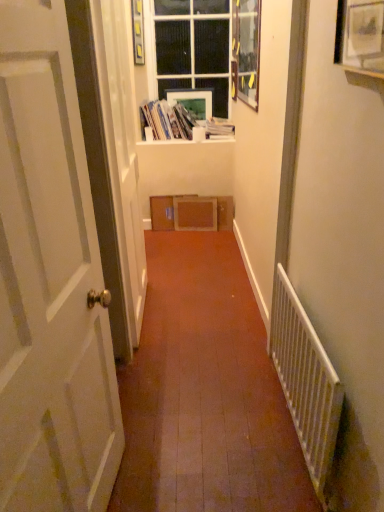
Question: Which direction should I rotate to look at matte white picture frame at upper center, the fourth picture frame when ordered from front to back?

Choices:
 (A) left
 (B) right

Answer: (A)

Question: From the image's perspective, would you say white paper book at upper center, placed as the second book when sorted from left to right, is positioned over wooden picture frame at upper center, which ranks as the 3th picture frame in back-to-front order?

Choices:
 (A) yes
 (B) no

Answer: (B)

Question: From the image's perspective, is white paper book at upper center, which ranks as the first book in right-to-left order, beneath wooden picture frame at upper center, which ranks as the 3th picture frame in back-to-front order?

Choices:
 (A) yes
 (B) no

Answer: (A)

Question: Is white paper book at upper center, which ranks as the first book in right-to-left order, in contact with wooden picture frame at upper center, which ranks as the 3th picture frame in back-to-front order?

Choices:
 (A) no
 (B) yes

Answer: (A)

Question: Would you say white paper book at upper center, which ranks as the first book in right-to-left order, is outside wooden picture frame at upper center, which ranks as the 3th picture frame in back-to-front order?

Choices:
 (A) no
 (B) yes

Answer: (B)

Question: Does white paper book at upper center, which ranks as the first book in right-to-left order, lie in front of wooden picture frame at upper center, which ranks as the 3th picture frame in back-to-front order?

Choices:
 (A) no
 (B) yes

Answer: (A)

Question: Does white paper book at upper center, which ranks as the first book in right-to-left order, appear on the right side of wooden picture frame at upper center, acting as the 2th picture frame starting from the right?

Choices:
 (A) yes
 (B) no

Answer: (B)

Question: Can you confirm if white wooden door at left is smaller than wooden picture frame at upper center, acting as the 2th picture frame starting from the right?

Choices:
 (A) no
 (B) yes

Answer: (A)

Question: Is white wooden door at left placed right next to wooden picture frame at upper center, which is counted as the third picture frame, starting from the left?

Choices:
 (A) no
 (B) yes

Answer: (A)

Question: Does white wooden door at left have a larger size compared to wooden picture frame at upper center, which ranks as the 3th picture frame in back-to-front order?

Choices:
 (A) yes
 (B) no

Answer: (A)

Question: Can you confirm if white wooden door at left is taller than wooden picture frame at upper center, which ranks as the 3th picture frame in back-to-front order?

Choices:
 (A) yes
 (B) no

Answer: (A)

Question: From the image's perspective, is white wooden door at left under wooden picture frame at upper center, acting as the 2th picture frame starting from the right?

Choices:
 (A) yes
 (B) no

Answer: (A)

Question: From a real-world perspective, does white wooden door at left sit lower than wooden picture frame at upper center, which ranks as the 3th picture frame in back-to-front order?

Choices:
 (A) no
 (B) yes

Answer: (B)

Question: Is white cardboard box at upper center, which appears as the 2th book when viewed from the right, touching matte white picture frame at upper center, marked as the 4th picture frame in a right-to-left arrangement?

Choices:
 (A) no
 (B) yes

Answer: (A)